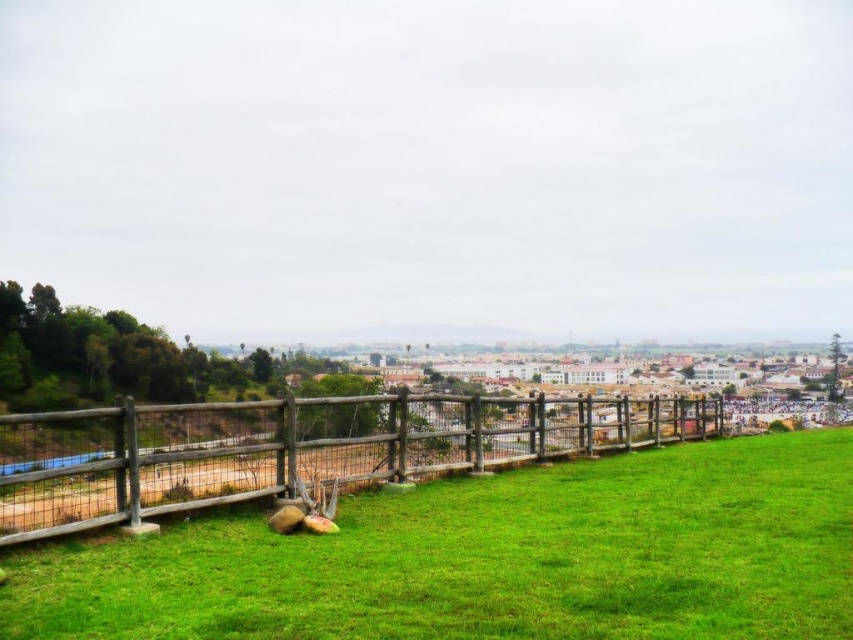
Based on the photo, between green grassy at center and brown wooden fence at lower left, which one has more height?

brown wooden fence at lower left is taller.

Measure the distance between point (289, 576) and camera.

The distance of point (289, 576) from camera is 100.94 feet.

Find the location of a particular element. Image resolution: width=853 pixels, height=640 pixels. green grassy at center is located at coordinates (490, 557).